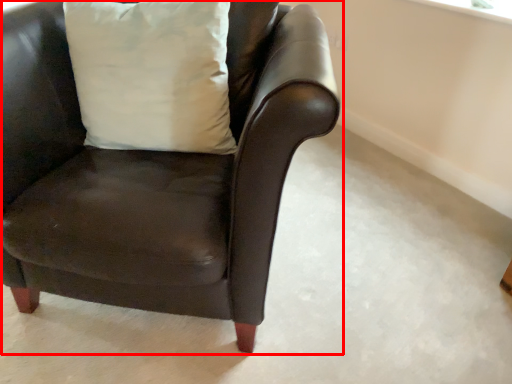
Question: From the image's perspective, where is chair (annotated by the red box) located in relation to pillow in the image?

Choices:
 (A) below
 (B) above

Answer: (A)